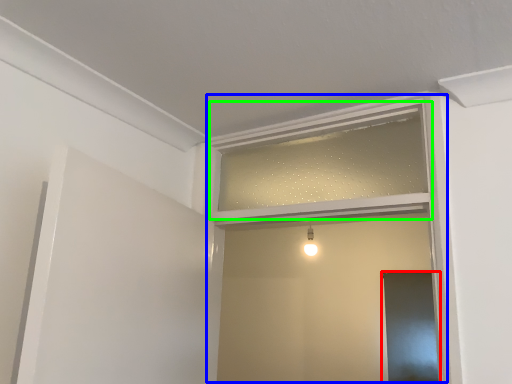
Question: Which is farther away from screen door (highlighted by a red box)? window frame (highlighted by a blue box) or window frame (highlighted by a green box)?

Choices:
 (A) window frame
 (B) window frame

Answer: (A)